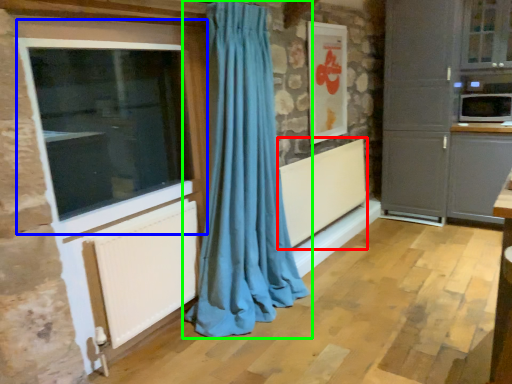
Question: Estimate the real-world distances between objects in this image. Which object is farther from radiator (highlighted by a red box), window (highlighted by a blue box) or curtain (highlighted by a green box)?

Choices:
 (A) window
 (B) curtain

Answer: (A)